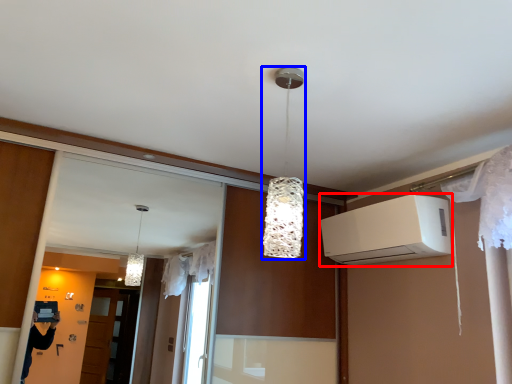
Question: Which point is closer to the camera, air conditioning (highlighted by a red box) or lamp (highlighted by a blue box)?

Choices:
 (A) air conditioning
 (B) lamp

Answer: (B)